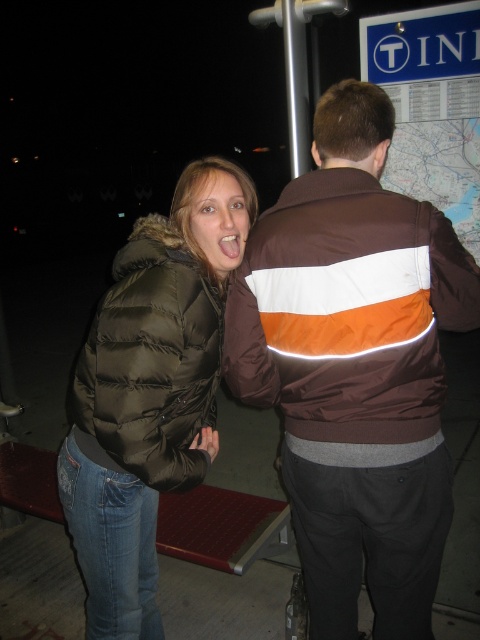
Is matte black puffer jacket at left shorter than dark green puffer jacket at left?

Incorrect, matte black puffer jacket at left's height does not fall short of dark green puffer jacket at left's.

Locate an element on the screen. The height and width of the screenshot is (640, 480). matte black puffer jacket at left is located at coordinates (149, 392).

Where is `matte black puffer jacket at left`? matte black puffer jacket at left is located at coordinates (149, 392).

Is brown/white/orange striped jacket at center positioned in front of dark green puffer jacket at left?

Yes, it is.

Which is behind, point (387, 211) or point (132, 253)?

The point (132, 253) is more distant.

Is point (423, 252) positioned behind point (144, 298)?

That is False.

The image size is (480, 640). In order to click on brown/white/orange striped jacket at center in this screenshot , I will do `click(355, 368)`.

Between brown/white/orange striped jacket at center and matte black puffer jacket at left, which one has less height?

matte black puffer jacket at left

Image resolution: width=480 pixels, height=640 pixels. Describe the element at coordinates (355, 368) in the screenshot. I see `brown/white/orange striped jacket at center` at that location.

This screenshot has height=640, width=480. Identify the location of brown/white/orange striped jacket at center. (355, 368).